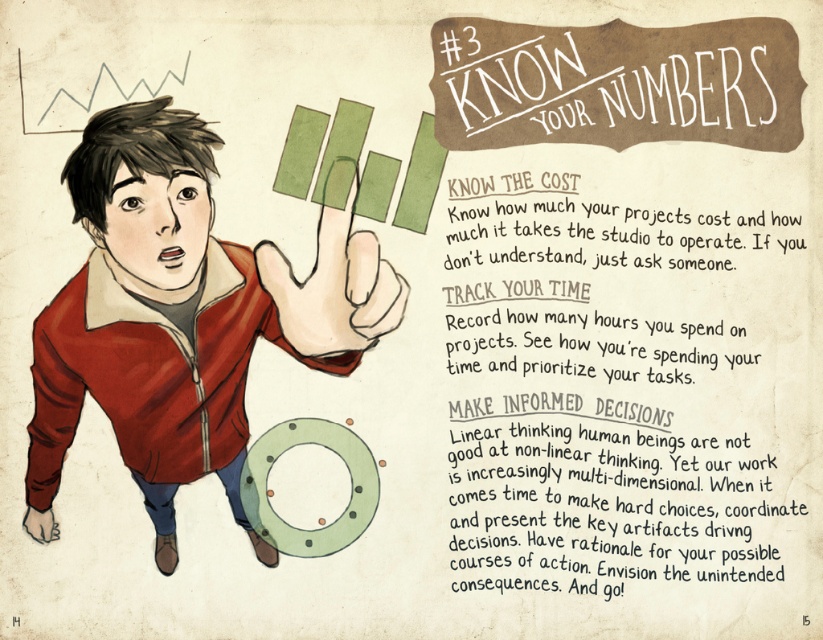
Question: Which object is farther from the camera taking this photo?

Choices:
 (A) green matte horseshoe at lower center
 (B) matte red jacket at center
 (C) brown paper text at upper center

Answer: (A)

Question: Which point is farther from the camera taking this photo?

Choices:
 (A) (315, 298)
 (B) (96, 385)
 (C) (319, 538)
 (D) (591, 408)

Answer: (A)

Question: Does brown paper text at upper center have a larger size compared to green matte horseshoe at lower center?

Choices:
 (A) yes
 (B) no

Answer: (A)

Question: Considering the real-world distances, which object is farthest from the green matte horseshoe at lower center?

Choices:
 (A) brown paper text at upper center
 (B) matte red jacket at center
 (C) green matte finger at center

Answer: (A)

Question: Is green matte finger at center above green matte horseshoe at lower center?

Choices:
 (A) no
 (B) yes

Answer: (B)

Question: In this image, where is matte red jacket at center located relative to green matte horseshoe at lower center?

Choices:
 (A) above
 (B) below

Answer: (A)